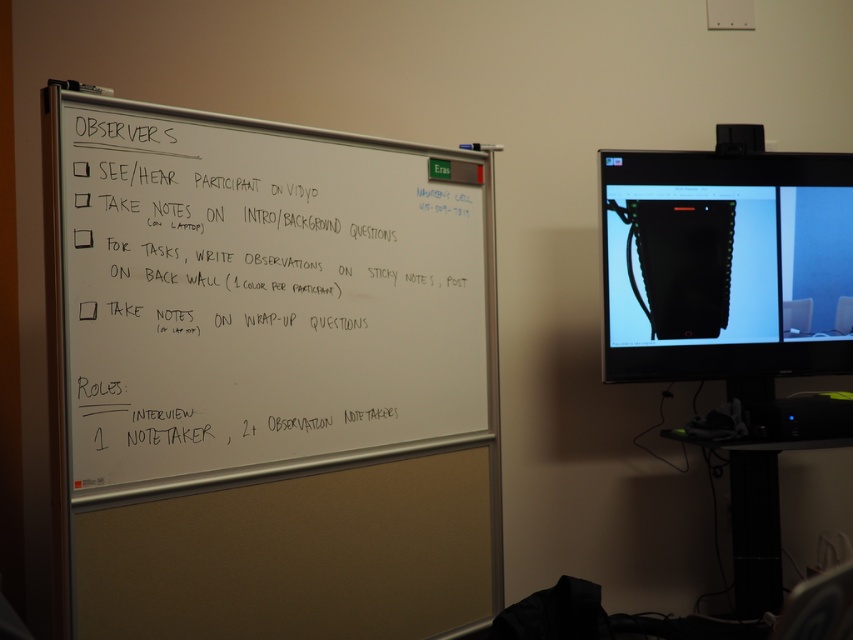
Does whiteboard at left have a lesser width compared to matte black bag at upper right?

No.

Is whiteboard at left below matte black bag at upper right?

Yes.

Locate an element on the screen. whiteboard at left is located at coordinates (267, 376).

Where is `whiteboard at left`? Image resolution: width=853 pixels, height=640 pixels. whiteboard at left is located at coordinates (267, 376).